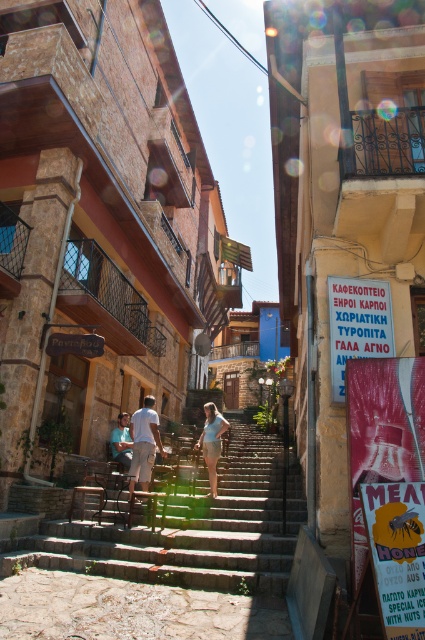
Does light blue denim shorts at center appear on the left side of light blue shirt at center?

No, light blue denim shorts at center is not to the left of light blue shirt at center.

Is light blue denim shorts at center smaller than light blue shirt at center?

Actually, light blue denim shorts at center might be larger than light blue shirt at center.

Which is in front, point (212, 435) or point (113, 433)?

Point (212, 435)

The width and height of the screenshot is (425, 640). In order to click on light blue denim shorts at center in this screenshot , I will do `click(212, 442)`.

Consider the image. Does light brown shorts at center appear under light blue denim shorts at center?

No, light brown shorts at center is not below light blue denim shorts at center.

Is light brown shorts at center above light blue denim shorts at center?

Yes.

This screenshot has width=425, height=640. Describe the element at coordinates (144, 440) in the screenshot. I see `light brown shorts at center` at that location.

Where is `light brown shorts at center`? This screenshot has height=640, width=425. light brown shorts at center is located at coordinates (144, 440).

Which is behind, point (149, 410) or point (127, 458)?

Point (127, 458)

Is light brown shorts at center taller than light blue shirt at center?

Yes, light brown shorts at center is taller than light blue shirt at center.

The height and width of the screenshot is (640, 425). I want to click on light brown shorts at center, so click(x=144, y=440).